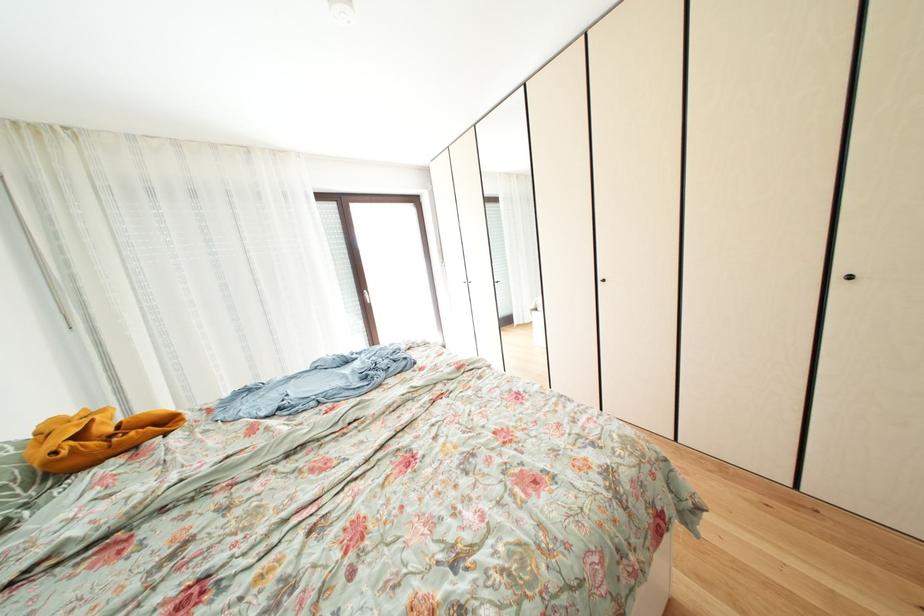
This screenshot has width=924, height=616. What do you see at coordinates (367, 298) in the screenshot? I see `a glass door handle` at bounding box center [367, 298].